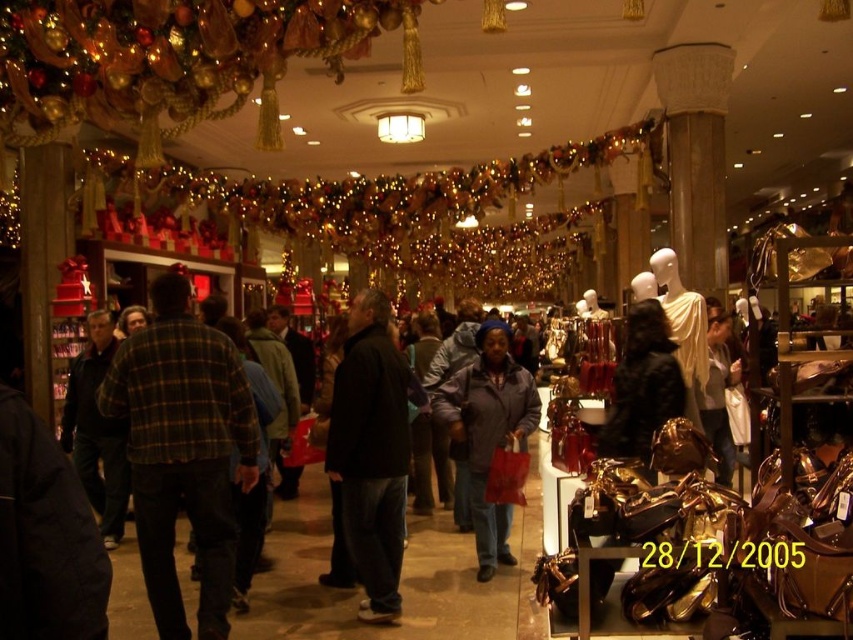
Can you confirm if black matte jacket at center is shorter than dark gray matte jacket at center?

Incorrect, black matte jacket at center's height does not fall short of dark gray matte jacket at center's.

The image size is (853, 640). I want to click on black matte jacket at center, so click(370, 452).

I want to click on black matte jacket at center, so click(370, 452).

Does plaid flannel shirt at center appear under black matte jacket at center?

No, plaid flannel shirt at center is not below black matte jacket at center.

Looking at this image, does plaid flannel shirt at center lie in front of black matte jacket at center?

Yes, plaid flannel shirt at center is closer to the viewer.

The image size is (853, 640). Describe the element at coordinates (183, 451) in the screenshot. I see `plaid flannel shirt at center` at that location.

Where is `plaid flannel shirt at center`? Image resolution: width=853 pixels, height=640 pixels. plaid flannel shirt at center is located at coordinates (183, 451).

Measure the distance from plaid flannel shirt at center to dark gray matte jacket at center.

They are 6.85 feet apart.

Between point (167, 468) and point (494, 518), which one is positioned in front?

Point (167, 468)

The width and height of the screenshot is (853, 640). Identify the location of plaid flannel shirt at center. (183, 451).